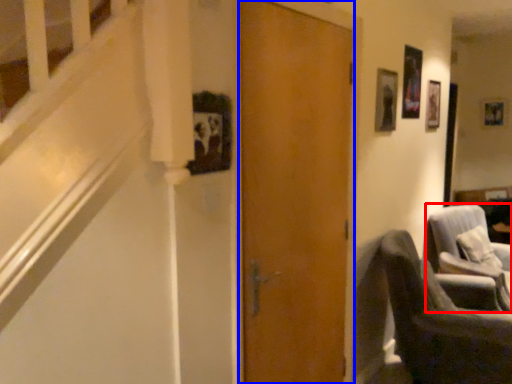
Question: Among these objects, which one is farthest to the camera, chair (highlighted by a red box) or door (highlighted by a blue box)?

Choices:
 (A) chair
 (B) door

Answer: (A)